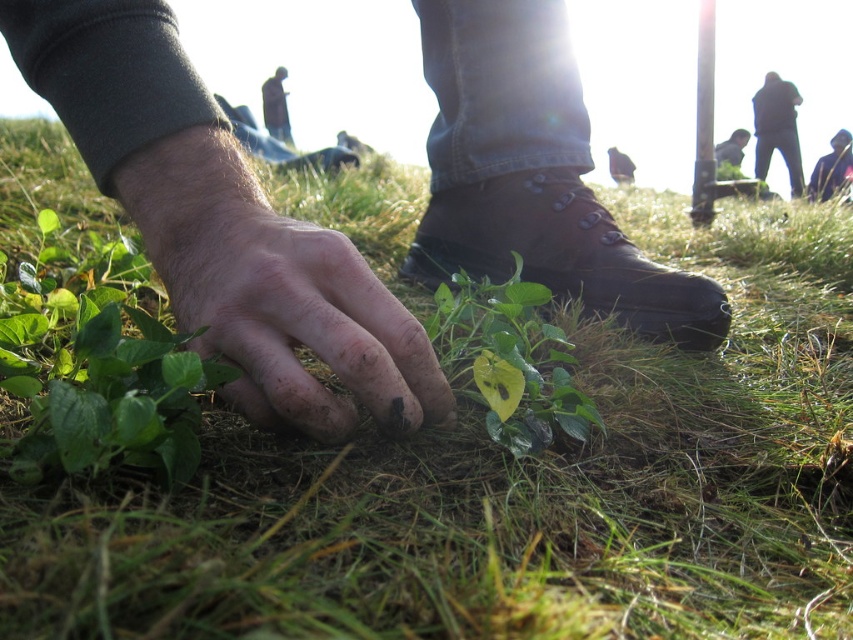
You are standing in a natural outdoor setting and see a small plant growing in grass. You want to reach out and touch it. Given that your arm can extend 1.5 meters, will you be able to touch the point at coordinates point (268, 99)?

The point at coordinates point (268, 99) is 4.66 meters away from the viewer. Since your arm can only extend 1.5 meters, you will not be able to reach it.

You are a photographer trying to capture a close shot of the plant. You notice the dirty skin hand at center and the dark gray fabric at lower right in your frame. Which object should you adjust to ensure the plant remains the main focus?

The dirty skin hand at center is wider than the dark gray fabric at lower right, so you should adjust the dirty skin hand at center to make it smaller or move it out of the frame to keep the plant as the main focus.

You are a photographer trying to focus on the hand touching the plant. The coordinates given are part of the scene. Which object at the lower right is located at point (831, 168)?

The point (831, 168) corresponds to the dark blue jacket at lower right.